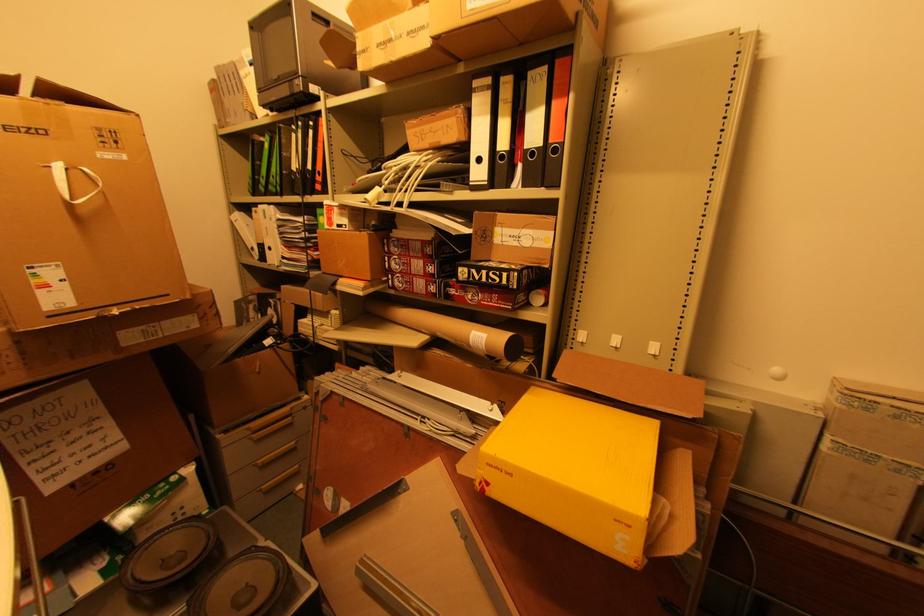
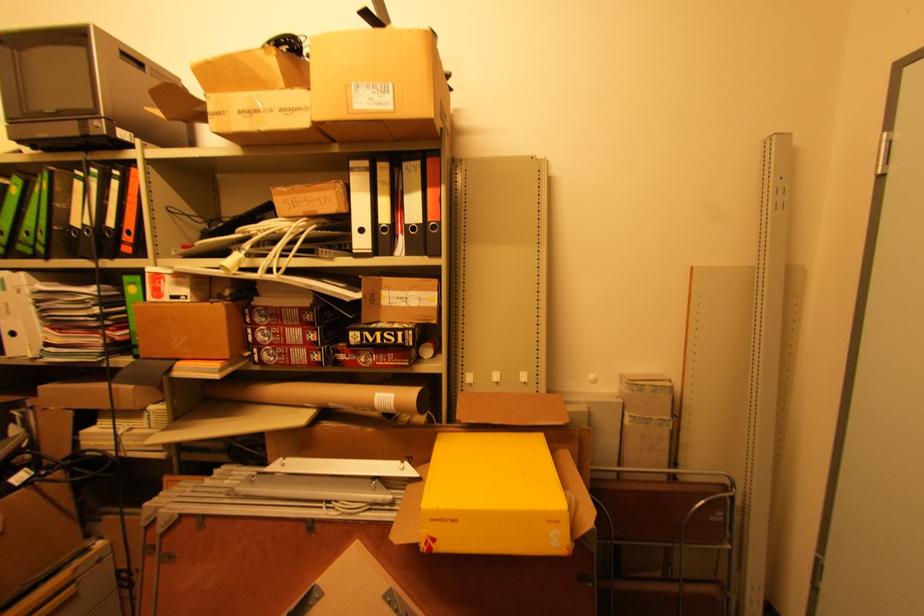
In the second image, find the point that corresponds to the point at 500,469 in the first image.

(444, 521)